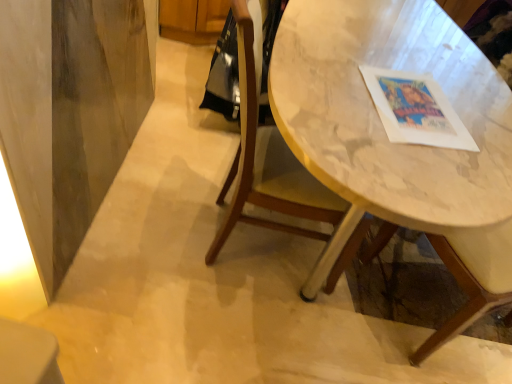
Find the location of a particular element. This screenshot has height=384, width=512. free location to the left of wooden chair at center is located at coordinates (149, 216).